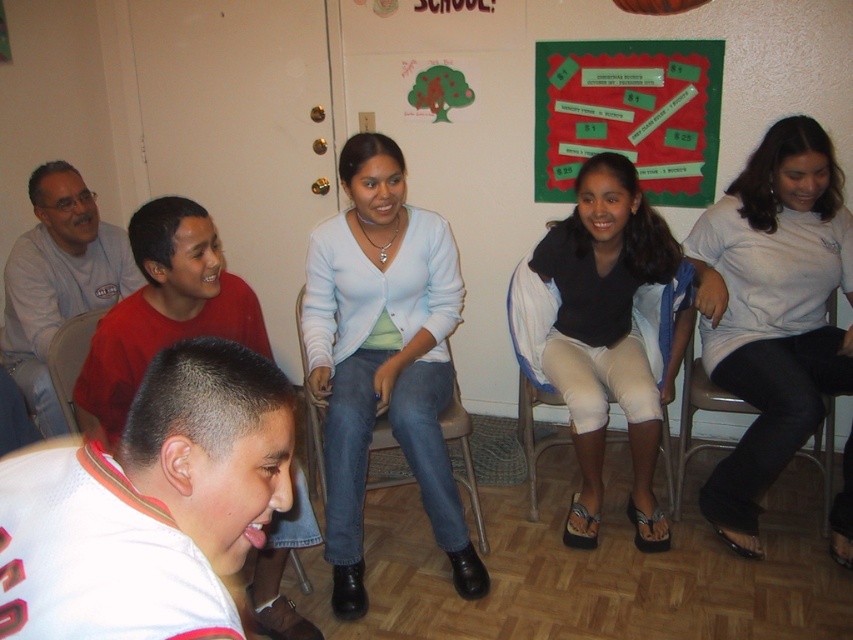
You are a photographer trying to capture a candid shot of the gray matte shirt at left and the matte plastic chair at left. Since you want to focus on the shirt, which object should you position closer to the camera?

The gray matte shirt at left is above the matte plastic chair at left, so positioning the shirt closer to the camera will ensure it remains the focus.

In the image, there is a light blue cardigan at center. Where exactly is it located in terms of coordinates?

The light blue cardigan at center is located at point (383,356).

You are a photographer setting up for a group photo. You need to ensure that the light blue cardigan at center is visible in the frame without being blocked by the metallic silver chair at center. Based on their sizes, is this possible?

The light blue cardigan at center has a lesser width compared to the metallic silver chair at center, so it is possible to position the camera angle so that the narrower light blue cardigan at center remains visible without being fully obscured by the wider metallic silver chair at center.